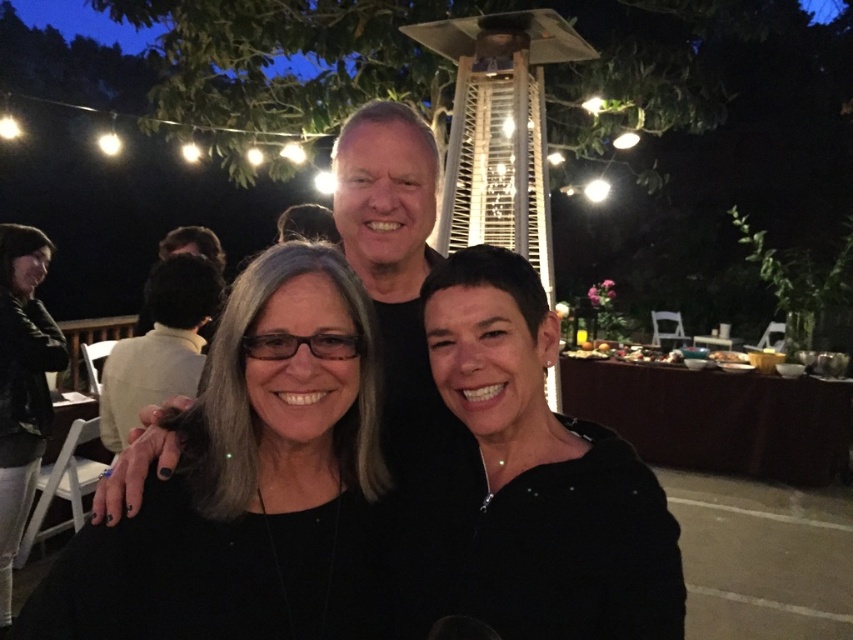
Question: Which of the following is the closest to the observer?

Choices:
 (A) black matte/black shirt at center
 (B) smooth brown hair at center
 (C) black matte glasses at center
 (D) matte black shirt at center

Answer: (C)

Question: Does black matte/soft fabric at center appear under smooth brown hair at center?

Choices:
 (A) yes
 (B) no

Answer: (A)

Question: Does black matte/black shirt at center appear on the right side of matte black shirt at center?

Choices:
 (A) yes
 (B) no

Answer: (A)

Question: Which point is farther to the camera?

Choices:
 (A) (531, 346)
 (B) (19, 449)
 (C) (143, 358)

Answer: (B)

Question: Which point appears farthest from the camera in this image?

Choices:
 (A) (654, 621)
 (B) (392, 145)

Answer: (B)

Question: Can you confirm if black matte/soft fabric at center is wider than matte black shirt at center?

Choices:
 (A) no
 (B) yes

Answer: (B)